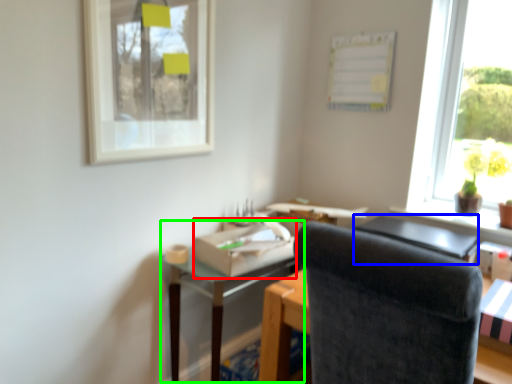
Question: Estimate the real-world distances between objects in this image. Which object is closer to cardboard box (highlighted by a red box), table (highlighted by a blue box) or table (highlighted by a green box)?

Choices:
 (A) table
 (B) table

Answer: (B)